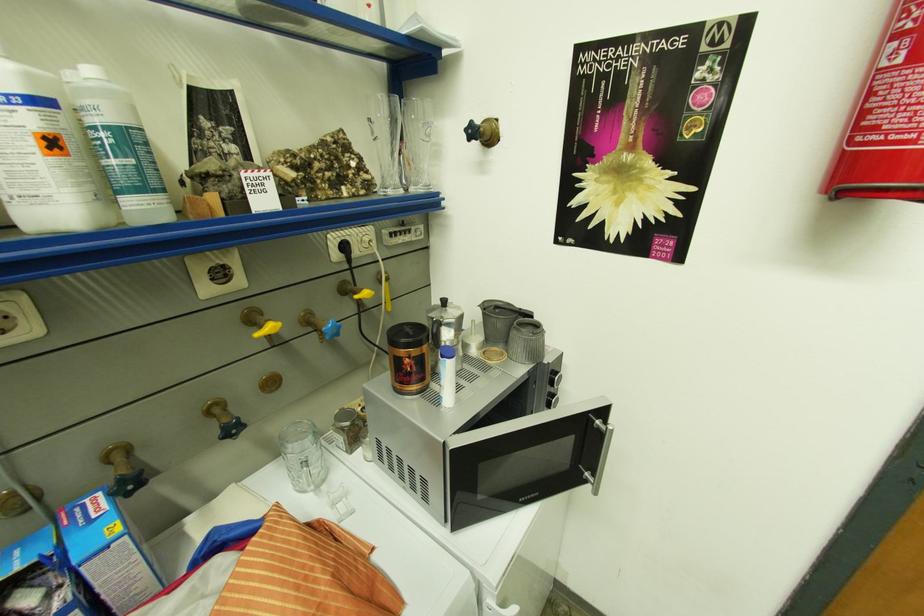
Where is `fire extinguisher handle`? fire extinguisher handle is located at coordinates (886, 120).